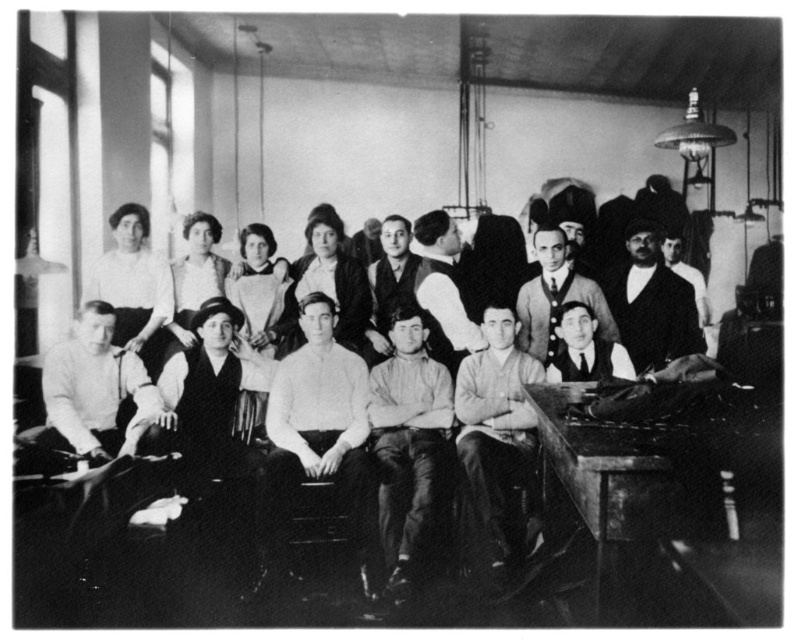
You are a photographer setting up a shoot in this historical classroom. You need to place a 2.5 feet wide decorative item between the wooden table at lower right and the smooth white blouse at center. Can you fit it there based on their widths?

The wooden table at lower right might be wider than smooth white blouse at center. Since the decorative item is 2.5 feet wide, it depends on the actual width of the table and blouse. However, since the table is at the lower right and the blouse is at center, there might be enough space between them to fit the item, but the exact fit is uncertain without precise measurements.

You are organizing a historical fashion exhibit and need to display the smooth white blouse at upper left and the white knit sweater at center. Based on their positions in the image, which item should you place on a wider display stand to accommodate its size?

The smooth white blouse at upper left might be wider than white knit sweater at center, so it should be placed on a wider display stand to accommodate its size.

You are an observer in the classroom scene. You notice two white garments worn by different people. The smooth white blouse at upper left and the white knit sweater at center. Which garment is positioned more to the left side of the image?

The smooth white blouse at upper left is positioned more to the left side of the image than the white knit sweater at center.